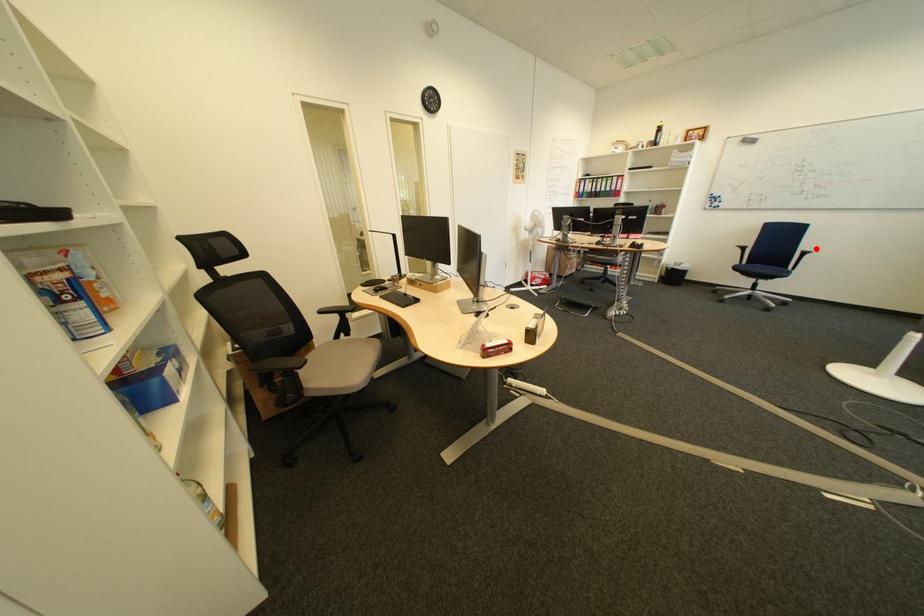
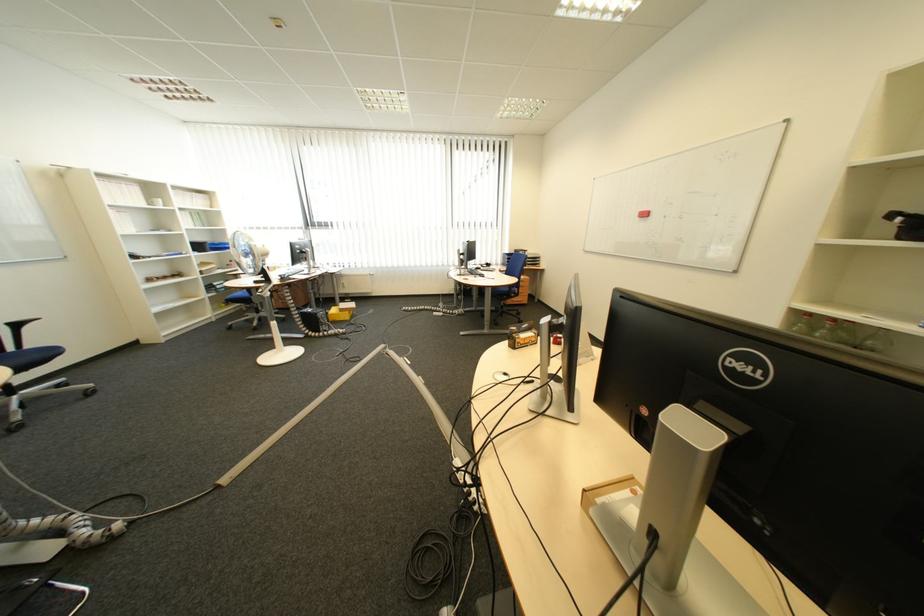
Question: I am providing you with two images of the same scene from different viewpoints. Image1 has a red point marked. In image2, the corresponding 3D location appears at what relative position? Reply with the corresponding letter.

Choices:
 (A) Closer
 (B) Farther

Answer: (B)